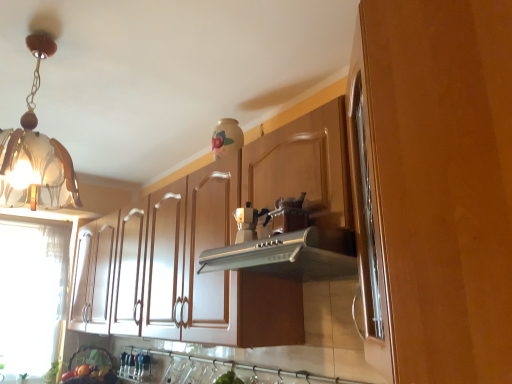
Question: From the image's perspective, relative to translucent glass pendant light at upper left, is wooden cabinet at center, marked as the 1th cabinetry in a front-to-back arrangement, above or below?

Choices:
 (A) above
 (B) below

Answer: (B)

Question: From a real-world perspective, is wooden cabinet at center, the second cabinetry viewed from the back, positioned above or below translucent glass pendant light at upper left?

Choices:
 (A) below
 (B) above

Answer: (A)

Question: Considering the real-world distances, which object is farthest from the wooden cabinet at center, the second cabinetry viewed from the back?

Choices:
 (A) matte brown cabinet at center, the first cabinetry in the back-to-front sequence
 (B) matte silver coffee machine at center
 (C) silver metallic vent at center
 (D) translucent glass pendant light at upper left

Answer: (D)

Question: Which is nearer to the wooden cabinet at center, marked as the 1th cabinetry in a front-to-back arrangement?

Choices:
 (A) matte brown cabinet at center, the first cabinetry in the back-to-front sequence
 (B) translucent glass pendant light at upper left
 (C) silver metallic vent at center
 (D) matte silver coffee machine at center

Answer: (C)